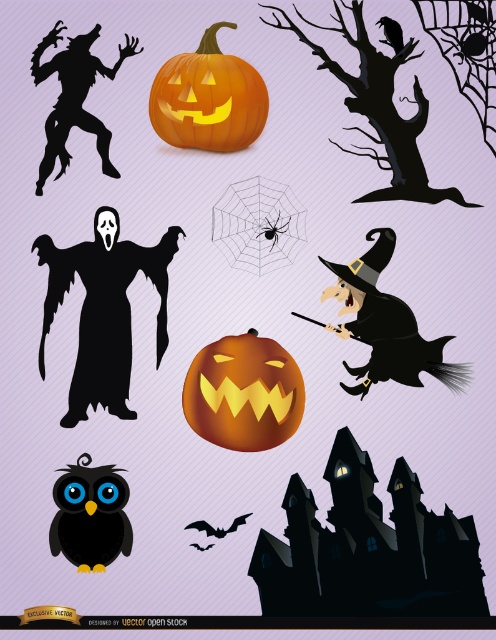
You are standing in front of the Halloween scene and want to touch the two points marked in the image. Which point, point at (237, 125) or point at (53, 58), will require you to reach out further to touch it?

Point at (53, 58) requires reaching further because it is farther from the camera compared to point at (237, 125).